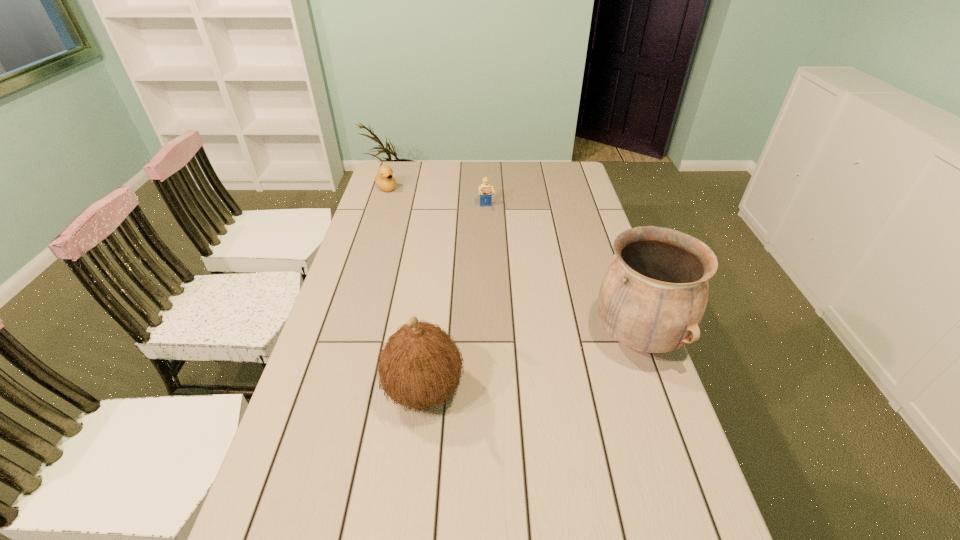
Locate an element on the screen. empty location between the third object from right to left and the rightmost object is located at coordinates (531, 364).

Identify the location of empty location between the farthest object and the rightmost object. Image resolution: width=960 pixels, height=540 pixels. (512, 262).

I want to click on free space that is in between the Lego and the duckling, so click(436, 198).

What are the coordinates of `empty location between the coconut and the rightmost object` in the screenshot? It's located at (531, 364).

The width and height of the screenshot is (960, 540). I want to click on vacant area that lies between the leftmost object and the urn, so click(512, 262).

Identify which object is located as the second nearest to the duckling. Please provide its 2D coordinates. Your answer should be formatted as a tuple, i.e. [(x, y)], where the tuple contains the x and y coordinates of a point satisfying the conditions above.

[(420, 366)]

Identify which object is located as the second nearest to the urn. Please provide its 2D coordinates. Your answer should be formatted as a tuple, i.e. [(x, y)], where the tuple contains the x and y coordinates of a point satisfying the conditions above.

[(485, 192)]

Where is `vacant area in the image that satisfies the following two spatial constraints: 1. on the front side of the coconut; 2. on the surface of the leftmost object`? Image resolution: width=960 pixels, height=540 pixels. vacant area in the image that satisfies the following two spatial constraints: 1. on the front side of the coconut; 2. on the surface of the leftmost object is located at coordinates pyautogui.click(x=322, y=390).